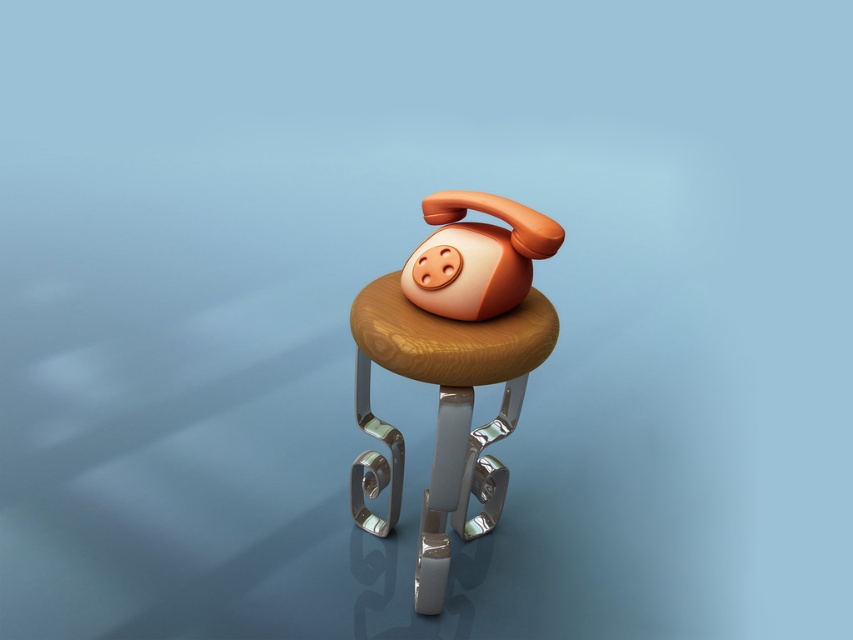
Question: Does woodenmaterial/texturestool at center appear on the right side of matte orange plastic piggy bank at center?

Choices:
 (A) yes
 (B) no

Answer: (B)

Question: Does woodenmaterial/texturestool at center come behind matte orange plastic piggy bank at center?

Choices:
 (A) yes
 (B) no

Answer: (B)

Question: Where is woodenmaterial/texturestool at center located in relation to matte orange plastic piggy bank at center in the image?

Choices:
 (A) left
 (B) right

Answer: (A)